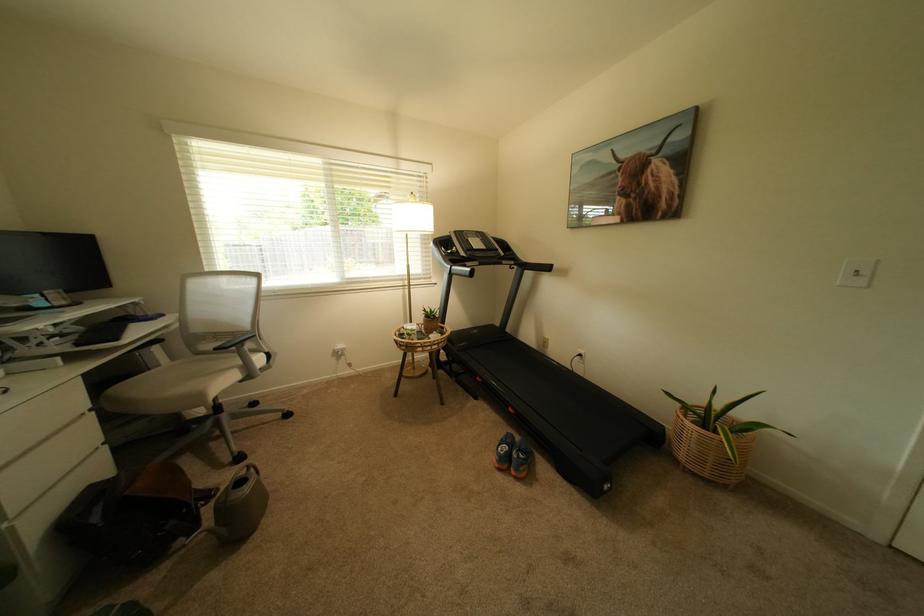
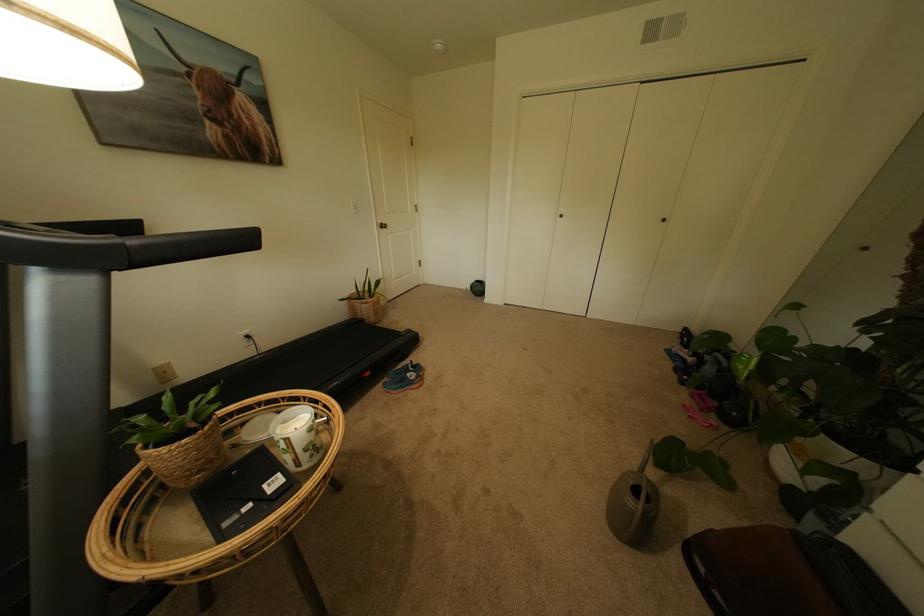
Find the pixel in the second image that matches point (626, 185) in the first image.

(204, 100)